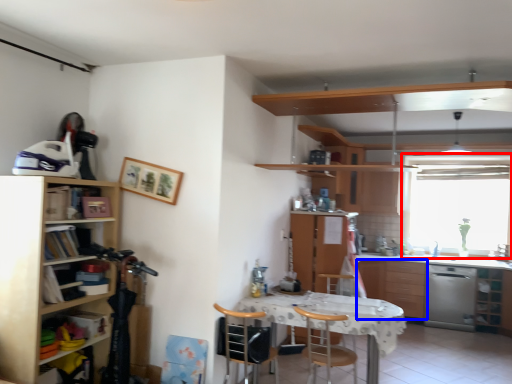
Question: Which object appears farthest to the camera in this image, window (highlighted by a red box) or cabinetry (highlighted by a blue box)?

Choices:
 (A) window
 (B) cabinetry

Answer: (A)